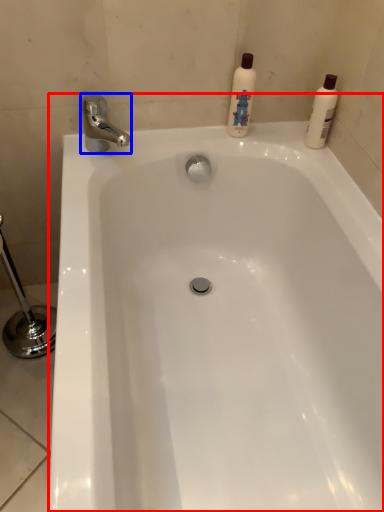
Question: Which object is closer to the camera taking this photo, bathtub (highlighted by a red box) or tap (highlighted by a blue box)?

Choices:
 (A) bathtub
 (B) tap

Answer: (A)